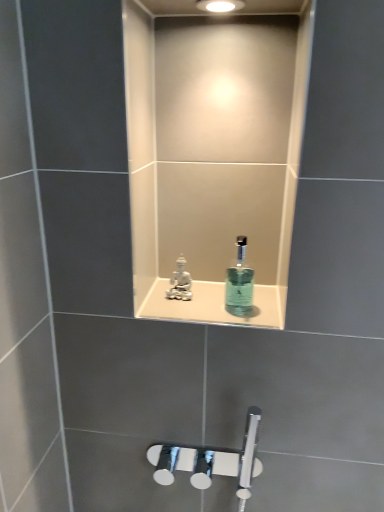
Locate an element on the screen. The height and width of the screenshot is (512, 384). blank space to the left of translucent glass mouthwash at center is located at coordinates (190, 313).